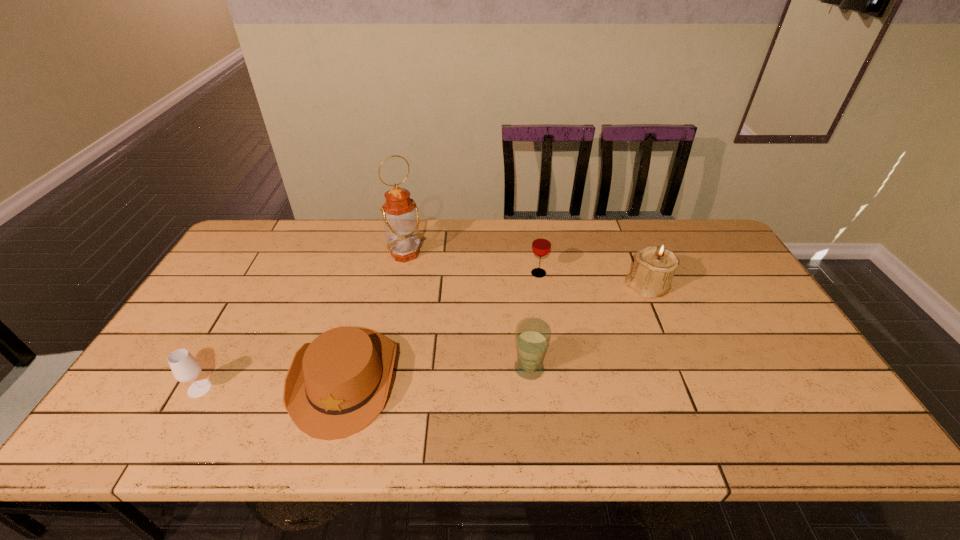
The width and height of the screenshot is (960, 540). Find the location of `free location located 0.310m on the right of the fifth tallest object`. free location located 0.310m on the right of the fifth tallest object is located at coordinates coord(341,388).

The height and width of the screenshot is (540, 960). I want to click on object located in the far edge section of the desktop, so click(400, 213).

Where is `object present at the near edge`? Image resolution: width=960 pixels, height=540 pixels. object present at the near edge is located at coordinates (336, 385).

Find the location of a particular element. The image size is (960, 540). object that is at the left edge is located at coordinates (185, 368).

The height and width of the screenshot is (540, 960). In the image, there is a desktop. What are the coordinates of `free region at the far edge` in the screenshot? It's located at (452, 240).

Where is `free region at the near edge`? free region at the near edge is located at coordinates (555, 443).

In order to click on vacant region at the far left corner of the desktop in this screenshot , I will do `click(233, 259)`.

Where is `vacant space at the far right corner of the desktop`? vacant space at the far right corner of the desktop is located at coordinates (712, 256).

Identify the location of free space between the shortest object and the candle_holder. The image size is (960, 540). (496, 333).

Identify the location of free spot between the fifth tallest object and the rightmost object. (423, 338).